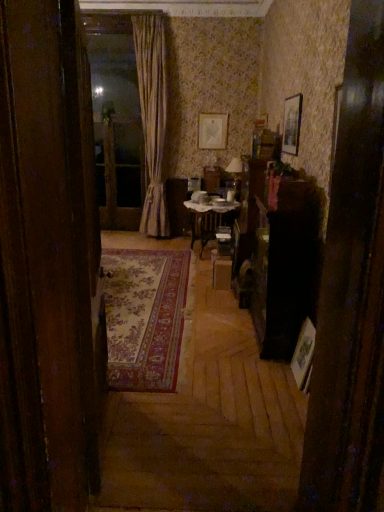
You are a GUI agent. You are given a task and a screenshot of the screen. Output one action in this format:
    pyautogui.click(x=<x>, y=<y>)
    Task: Click on the wooden table at center
    The height and width of the screenshot is (512, 384).
    Given the screenshot: What is the action you would take?
    pyautogui.click(x=210, y=218)

The width and height of the screenshot is (384, 512). Identify the location of matte gold picture frame at upper center, which is the first picture frame in top-to-bottom order. (212, 131).

What is the approximate height of matte gold picture frame at upper center, which ranks as the first picture frame in back-to-front order?

The height of matte gold picture frame at upper center, which ranks as the first picture frame in back-to-front order, is 55.03 centimeters.

Measure the distance between wooden door at left and camera.

They are 1.02 meters apart.

What is the approximate height of wooden picture frame at upper right, which appears as the 2th picture frame when viewed from the front?

wooden picture frame at upper right, which appears as the 2th picture frame when viewed from the front, is 20.74 inches tall.

Identify the location of gold textured curtain at center. (152, 117).

Does transparent glass screen door at upper center have a lesser height compared to wooden picture frame at upper right, positioned as the first picture frame in right-to-left order?

In fact, transparent glass screen door at upper center may be taller than wooden picture frame at upper right, positioned as the first picture frame in right-to-left order.

In the scene shown: Can you confirm if transparent glass screen door at upper center is bigger than wooden picture frame at upper right, which is counted as the second picture frame, starting from the bottom?

Yes.

Is transparent glass screen door at upper center aimed at wooden picture frame at upper right, which appears as the 2th picture frame when viewed from the front?

No, transparent glass screen door at upper center is not aimed at wooden picture frame at upper right, which appears as the 2th picture frame when viewed from the front.

From the image's perspective, is wooden picture frame at right, which appears as the 1th picture frame when ordered from the bottom, under transparent glass screen door at upper center?

Correct, wooden picture frame at right, which appears as the 1th picture frame when ordered from the bottom, appears lower than transparent glass screen door at upper center in the image.

Which is less distant, (310, 340) or (128, 219)?

Point (310, 340) is positioned closer to the camera compared to point (128, 219).

Considering the relative positions of wooden picture frame at right, the 3th picture frame from the back, and transparent glass screen door at upper center in the image provided, is wooden picture frame at right, the 3th picture frame from the back, behind transparent glass screen door at upper center?

No, it is not.

Who is shorter, wooden picture frame at right, arranged as the third picture frame when viewed from the top, or transparent glass screen door at upper center?

Standing shorter between the two is wooden picture frame at right, arranged as the third picture frame when viewed from the top.

Do you think wooden picture frame at right, which ranks as the 1th picture frame in front-to-back order, is within wooden door at left, or outside of it?

wooden picture frame at right, which ranks as the 1th picture frame in front-to-back order, exists outside the volume of wooden door at left.

Does wooden picture frame at right, which appears as the 1th picture frame when ordered from the bottom, lie in front of wooden door at left?

No, the depth of wooden picture frame at right, which appears as the 1th picture frame when ordered from the bottom, is greater than that of wooden door at left.

Does wooden picture frame at right, which appears as the 1th picture frame when ordered from the bottom, have a smaller size compared to wooden door at left?

Yes.

Is wooden table at center aimed at wooden door at left?

No, wooden table at center is not facing towards wooden door at left.

From the picture: Can you confirm if wooden table at center is smaller than wooden door at left?

No.

How many degrees apart are the facing directions of wooden table at center and wooden door at left?

They differ by 166 degrees in their facing directions.

Can you confirm if wooden table at center is wider than wooden door at left?

Indeed, wooden table at center has a greater width compared to wooden door at left.

Considering the sizes of objects gold textured curtain at center and wooden door at left in the image provided, who is smaller, gold textured curtain at center or wooden door at left?

wooden door at left is smaller.

From a real-world perspective, is gold textured curtain at center on wooden door at left?

Yes, from a real-world perspective, gold textured curtain at center is over wooden door at left

What's the angular difference between gold textured curtain at center and wooden door at left's facing directions?

The facing directions of gold textured curtain at center and wooden door at left are 108 degrees apart.

In the scene shown: Considering the relative sizes of gold textured curtain at center and wooden door at left in the image provided, is gold textured curtain at center taller than wooden door at left?

Yes, gold textured curtain at center is taller than wooden door at left.

Is the position of wooden picture frame at upper right, arranged as the 2th picture frame when viewed from the back, more distant than that of wooden door at left?

Yes, wooden picture frame at upper right, arranged as the 2th picture frame when viewed from the back, is further from the camera.

Is wooden picture frame at upper right, arranged as the 2th picture frame when viewed from the back, surrounding wooden door at left?

Definitely not — wooden door at left is not inside wooden picture frame at upper right, arranged as the 2th picture frame when viewed from the back.

Does wooden picture frame at upper right, which is counted as the second picture frame, starting from the bottom, have a greater height compared to wooden door at left?

Incorrect, the height of wooden picture frame at upper right, which is counted as the second picture frame, starting from the bottom, is not larger of that of wooden door at left.

Would you say gold textured curtain at center is outside wooden table at center?

Yes, gold textured curtain at center is outside of wooden table at center.

Who is bigger, gold textured curtain at center or wooden table at center?

gold textured curtain at center.

Between gold textured curtain at center and wooden table at center, which one has less height?

With less height is wooden table at center.

Which is behind, point (158, 186) or point (207, 214)?

The point (158, 186) is farther from the camera.

Locate an element on the screen. The width and height of the screenshot is (384, 512). the 1st picture frame positioned below the transparent glass screen door at upper center (from the image's perspective) is located at coordinates (292, 124).

In order to click on picture frame that is the 3rd object located in front of the transparent glass screen door at upper center in this screenshot , I will do `click(304, 355)`.

Based on their spatial positions, is gold textured curtain at center or wooden picture frame at right, which ranks as the 1th picture frame in front-to-back order, closer to transparent glass screen door at upper center?

gold textured curtain at center is closer to transparent glass screen door at upper center.

From the image, which object appears to be farther from matte gold picture frame at upper center, which ranks as the first picture frame in back-to-front order, wooden picture frame at right, placed as the 2th picture frame when sorted from right to left, or transparent glass screen door at upper center?

wooden picture frame at right, placed as the 2th picture frame when sorted from right to left, lies further to matte gold picture frame at upper center, which ranks as the first picture frame in back-to-front order, than the other object.

Estimate the real-world distances between objects in this image. Which object is closer to gold textured curtain at center, wooden table at center or transparent glass screen door at upper center?

transparent glass screen door at upper center is closer to gold textured curtain at center.

From the image, which object appears to be nearer to matte gold picture frame at upper center, which is the third picture frame in right-to-left order, wooden door at left or wooden picture frame at upper right, arranged as the 2th picture frame when viewed from the back?

The object closer to matte gold picture frame at upper center, which is the third picture frame in right-to-left order, is wooden picture frame at upper right, arranged as the 2th picture frame when viewed from the back.

Estimate the real-world distances between objects in this image. Which object is further from transparent glass screen door at upper center, wooden door at left or wooden picture frame at right, the 2th picture frame positioned from the left?

Among the two, wooden door at left is located further to transparent glass screen door at upper center.

Based on their spatial positions, is matte gold picture frame at upper center, which is the third picture frame from front to back, or wooden table at center further from wooden door at left?

matte gold picture frame at upper center, which is the third picture frame from front to back, lies further to wooden door at left than the other object.

When comparing their distances from wooden picture frame at upper right, which is counted as the third picture frame, starting from the left, does wooden picture frame at right, the 2th picture frame positioned from the left, or gold textured curtain at center seem further?

The object further to wooden picture frame at upper right, which is counted as the third picture frame, starting from the left, is gold textured curtain at center.

Looking at the image, which one is located closer to wooden picture frame at right, which appears as the 1th picture frame when ordered from the bottom, wooden door at left or wooden table at center?

The object closer to wooden picture frame at right, which appears as the 1th picture frame when ordered from the bottom, is wooden door at left.

This screenshot has height=512, width=384. I want to click on curtain located between wooden picture frame at upper right, which is counted as the second picture frame, starting from the bottom, and matte gold picture frame at upper center, which is the third picture frame from front to back, in the depth direction, so click(152, 117).

This screenshot has width=384, height=512. I want to click on table positioned between wooden door at left and gold textured curtain at center from near to far, so click(x=210, y=218).

This screenshot has width=384, height=512. What are the coordinates of `curtain between wooden picture frame at upper right, arranged as the 2th picture frame when viewed from the back, and transparent glass screen door at upper center, along the z-axis` in the screenshot? It's located at (152, 117).

In order to click on table positioned between wooden door at left and matte gold picture frame at upper center, which ranks as the first picture frame in back-to-front order, from near to far in this screenshot , I will do `click(210, 218)`.